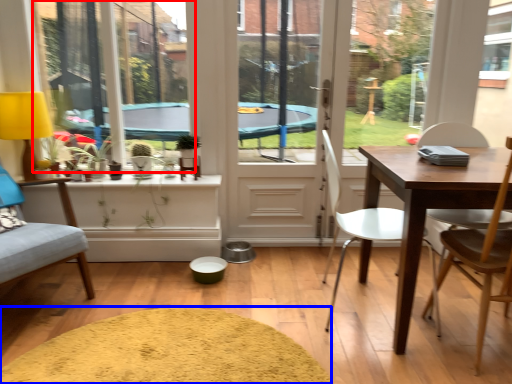
Question: Which object appears farthest to the camera in this image, window screen (highlighted by a red box) or wide (highlighted by a blue box)?

Choices:
 (A) window screen
 (B) wide

Answer: (A)